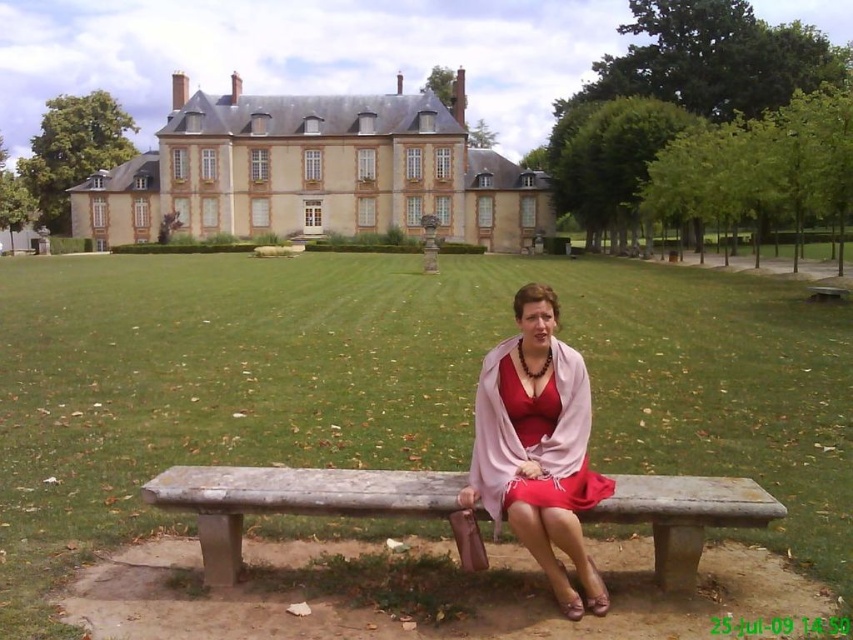
Question: Which object is farther from the camera taking this photo?

Choices:
 (A) beige stone palace at upper center
 (B) stone bench at center
 (C) matte pink shawl at center

Answer: (A)

Question: Which is farther from the stone bench at center?

Choices:
 (A) matte pink shawl at center
 (B) beige stone palace at upper center

Answer: (B)

Question: Considering the real-world distances, which object is closest to the beige stone palace at upper center?

Choices:
 (A) matte pink shawl at center
 (B) stone bench at center

Answer: (A)

Question: Does beige stone palace at upper center appear on the left side of matte pink shawl at center?

Choices:
 (A) no
 (B) yes

Answer: (B)

Question: Observing the image, what is the correct spatial positioning of beige stone palace at upper center in reference to stone bench at center?

Choices:
 (A) above
 (B) below

Answer: (A)

Question: Can you confirm if beige stone palace at upper center is positioned to the right of stone bench at center?

Choices:
 (A) no
 (B) yes

Answer: (A)